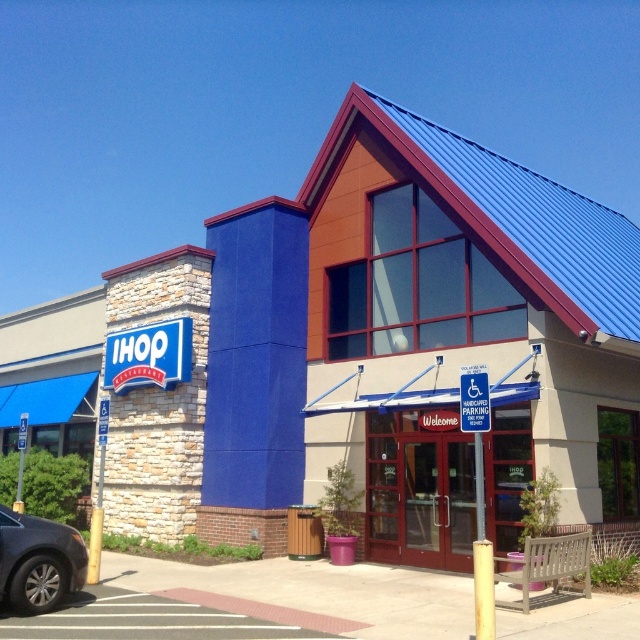
You are a delivery person arriving at the IHOP restaurant. You need to enter through the doors but are concerned about the height of your delivery van, which is 2 meters tall. Can you safely pass under the matte glass doors at center without hitting the shiny black sedan at lower left?

The matte glass doors at center is much taller than the shiny black sedan at lower left. Since the doors are taller, they are likely above the sedan, so the van can pass under the doors safely as long as it stays within the path near the doors and avoids the sedan.